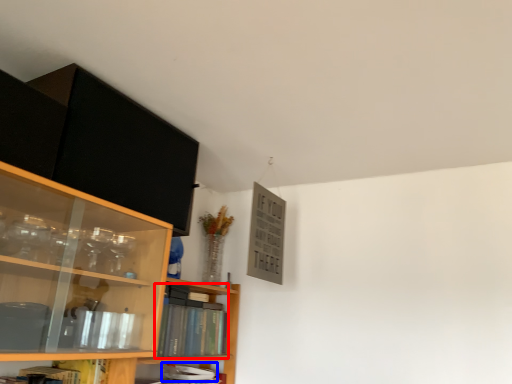
Question: Which point is further to the camera, book (highlighted by a red box) or book (highlighted by a blue box)?

Choices:
 (A) book
 (B) book

Answer: (B)